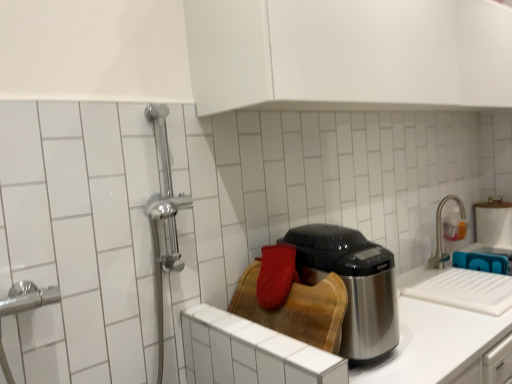
Where is `free space in front of satin nickel faucet at upper right`? free space in front of satin nickel faucet at upper right is located at coordinates (460, 273).